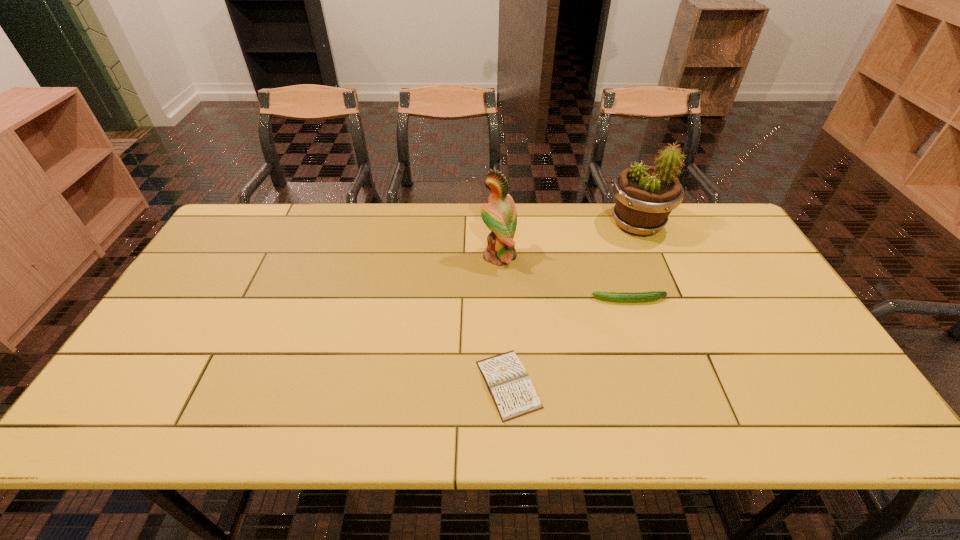
This screenshot has height=540, width=960. Find the location of `vacant space situated on the front-facing side of the third tallest object`. vacant space situated on the front-facing side of the third tallest object is located at coordinates (480, 300).

Where is `blank space located 0.150m on the front-facing side of the third tallest object`? The width and height of the screenshot is (960, 540). blank space located 0.150m on the front-facing side of the third tallest object is located at coordinates (538, 300).

I want to click on vacant space located 0.130m on the front-facing side of the third tallest object, so click(x=545, y=300).

In order to click on vacant space located on the left of the diary in this screenshot , I will do `click(322, 384)`.

Where is `flowerpot that is at the far edge`? flowerpot that is at the far edge is located at coordinates (645, 195).

Locate an element on the screen. Image resolution: width=960 pixels, height=540 pixels. parrot located in the far edge section of the desktop is located at coordinates pyautogui.click(x=499, y=214).

You are a GUI agent. You are given a task and a screenshot of the screen. Output one action in this format:
    pyautogui.click(x=<x>, y=<y>)
    Task: Click on the object present at the near edge
    This screenshot has height=540, width=960.
    Given the screenshot: What is the action you would take?
    pyautogui.click(x=514, y=395)

Where is `vacant space at the far edge`? The width and height of the screenshot is (960, 540). vacant space at the far edge is located at coordinates (587, 204).

This screenshot has width=960, height=540. What are the coordinates of `vacant space at the near edge of the desktop` in the screenshot? It's located at (392, 401).

At what (x,y) coordinates should I click in order to perform the action: click on vacant space at the left edge of the desktop. Please return your answer as a coordinate pair (x, y). The image size is (960, 540). Looking at the image, I should click on (179, 326).